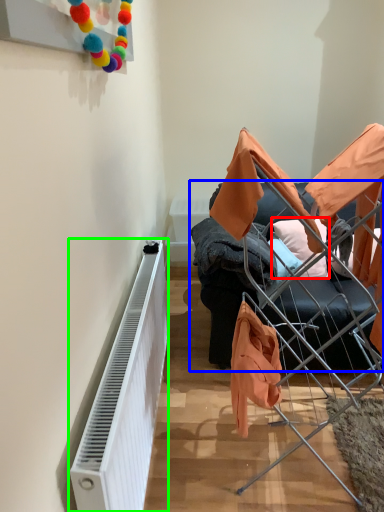
Question: Estimate the real-world distances between objects in this image. Which object is farther from pillow (highlighted by a red box), furniture (highlighted by a blue box) or radiator (highlighted by a green box)?

Choices:
 (A) furniture
 (B) radiator

Answer: (B)